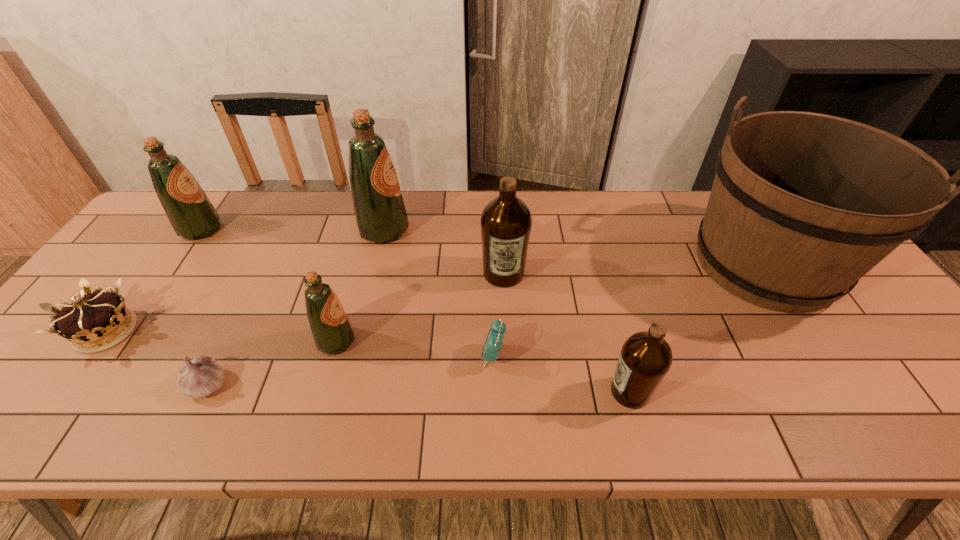
You are a GUI agent. You are given a task and a screenshot of the screen. Output one action in this format:
    pyautogui.click(x=<x>, y=<y>)
    Task: Click on the gold crown
    This screenshot has width=960, height=540.
    Given the screenshot: What is the action you would take?
    pyautogui.click(x=91, y=323)

Identify the location of alarm clock. Image resolution: width=960 pixels, height=540 pixels. (493, 344).

You are a GUI agent. You are given a task and a screenshot of the screen. Output one action in this format:
    pyautogui.click(x=<x>, y=<y>)
    Task: Click on the third object from left to right
    The height and width of the screenshot is (540, 960).
    Given the screenshot: What is the action you would take?
    pyautogui.click(x=202, y=376)

Identify the location of white garlic. (202, 376).

At what (x,y) coordinates should I click in order to perform the action: click on vacant space located 0.280m on the front of the bucket. Please return your answer as a coordinate pair (x, y). The image size is (960, 540). Looking at the image, I should click on (876, 438).

Where is `free space located on the front-facing side of the biggest green olive oil`? Image resolution: width=960 pixels, height=540 pixels. free space located on the front-facing side of the biggest green olive oil is located at coordinates (515, 230).

The width and height of the screenshot is (960, 540). Find the location of `vacant space situated 0.100m on the front-facing side of the second smallest green olive oil`. vacant space situated 0.100m on the front-facing side of the second smallest green olive oil is located at coordinates (254, 230).

At what (x,y) coordinates should I click in order to perform the action: click on vacant space situated on the label of the bigger brown olive oil. Please return your answer as a coordinate pair (x, y). The height and width of the screenshot is (540, 960). Looking at the image, I should click on (507, 343).

In order to click on free space located on the front-facing side of the smallest green olive oil in this screenshot , I will do `click(510, 341)`.

Where is `vacant space located on the label of the nearer brown olive oil`? This screenshot has width=960, height=540. vacant space located on the label of the nearer brown olive oil is located at coordinates (558, 392).